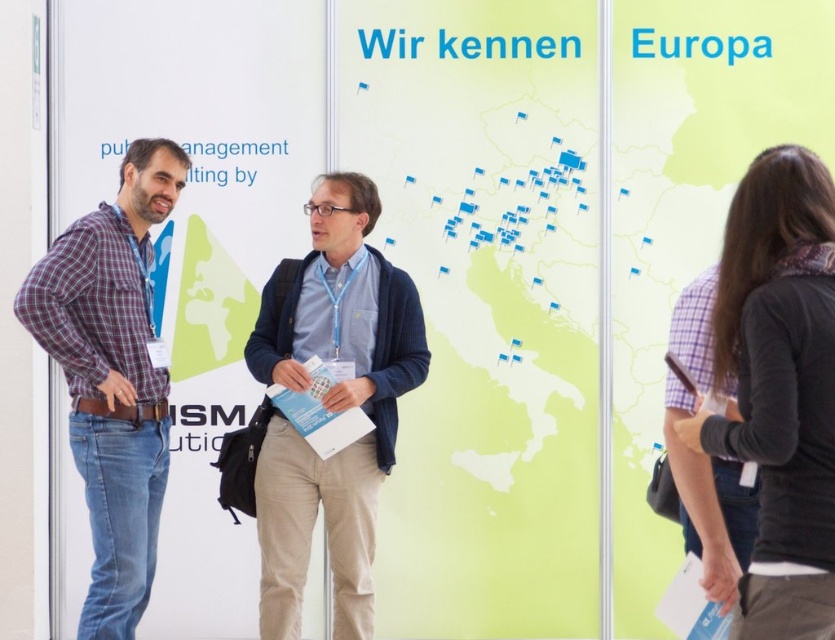
Does black sweater at right have a greater height compared to plaid cotton shirt at left?

In fact, black sweater at right may be shorter than plaid cotton shirt at left.

Is black sweater at right to the right of plaid cotton shirt at left from the viewer's perspective?

Indeed, black sweater at right is positioned on the right side of plaid cotton shirt at left.

Is point (772, 544) less distant than point (54, 330)?

That is True.

The image size is (835, 640). I want to click on black sweater at right, so click(x=778, y=387).

Identify the location of black sweater at right. This screenshot has height=640, width=835. (778, 387).

Is point (788, 456) farther from camera compared to point (291, 566)?

No, (788, 456) is closer to viewer.

Which is behind, point (828, 266) or point (296, 324)?

Point (296, 324)

Identify the location of black sweater at right. (778, 387).

Does blue corduroy sweater at center have a larger size compared to plaid cotton shirt at left?

Correct, blue corduroy sweater at center is larger in size than plaid cotton shirt at left.

Is blue corduroy sweater at center to the right of plaid cotton shirt at left from the viewer's perspective?

Yes, blue corduroy sweater at center is to the right of plaid cotton shirt at left.

I want to click on blue corduroy sweater at center, so click(331, 403).